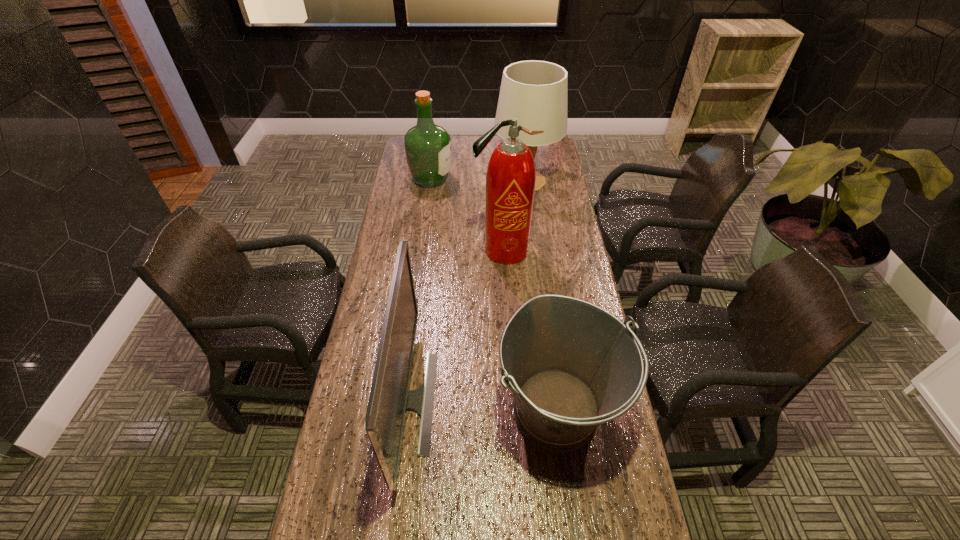
Identify the location of fire extinguisher. Image resolution: width=960 pixels, height=540 pixels. (510, 180).

You are a GUI agent. You are given a task and a screenshot of the screen. Output one action in this format:
    pyautogui.click(x=<x>, y=<y>)
    Task: Click on the table lamp
    The width and height of the screenshot is (960, 540).
    Given the screenshot: What is the action you would take?
    pyautogui.click(x=534, y=92)

Identify the location of liquor. (427, 146).

Where is `monitor`? monitor is located at coordinates (390, 397).

Locate an element on the screen. The image size is (960, 540). the shortest object is located at coordinates (570, 365).

This screenshot has height=540, width=960. I want to click on vacant space located on the back of the third farthest object, so click(500, 190).

Identify the location of vacant area located 0.190m on the front of the table lamp. (532, 231).

Where is `free region located on the front-facing side of the liquor`? The height and width of the screenshot is (540, 960). free region located on the front-facing side of the liquor is located at coordinates (531, 180).

Where is `free spot located on the screen side of the monitor`? free spot located on the screen side of the monitor is located at coordinates (520, 402).

Locate an element on the screen. This screenshot has height=540, width=960. vacant space located 0.080m on the back of the shortest object is located at coordinates coord(547,333).